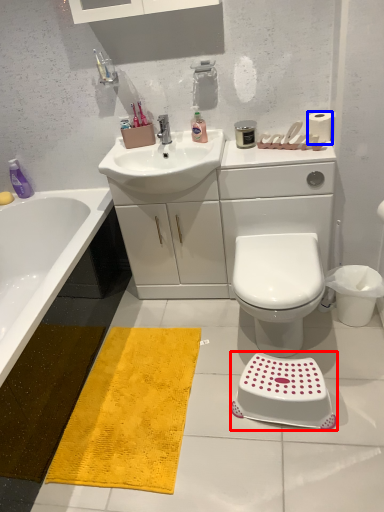
Question: Which point is closer to the camera, step stool (highlighted by a red box) or toilet paper (highlighted by a blue box)?

Choices:
 (A) step stool
 (B) toilet paper

Answer: (A)